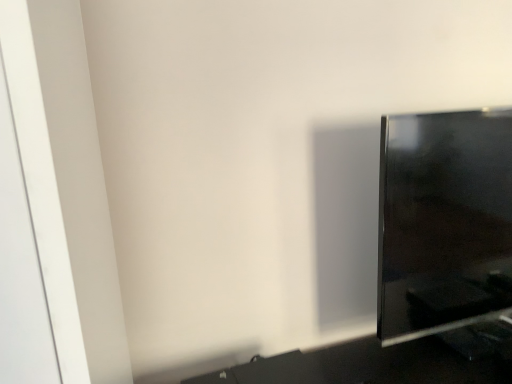
In order to face black glossy tv at right, should I rotate leftwards or rightwards?

A 25.424 degree turn to the right will do.

This screenshot has height=384, width=512. Find the location of `black glossy tv at right`. black glossy tv at right is located at coordinates (444, 222).

Describe the element at coordinates (444, 222) in the screenshot. I see `black glossy tv at right` at that location.

Identify the location of black glossy tv at right. The width and height of the screenshot is (512, 384). (444, 222).